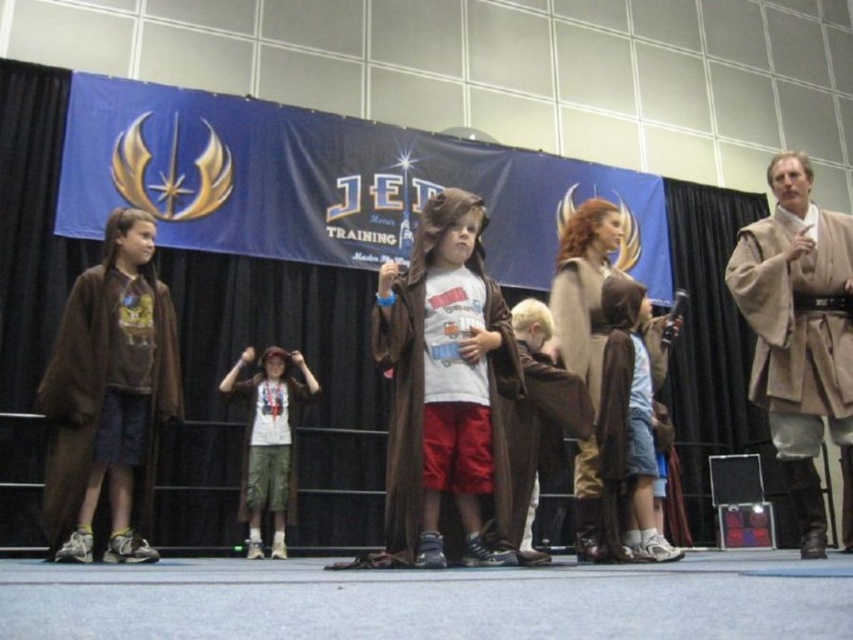
You are a costume designer trying to layer the beige wool robe at center over the white cotton shirt at center for a performance. Based on their thickness, which garment should be placed underneath?

The beige wool robe at center is thinner than the white cotton shirt at center, so the beige wool robe at center should be placed underneath the white cotton shirt at center to ensure proper layering.

You are a photographer at the Jedi Training event. You need to capture a photo that includes both the brown suede robe at left and the brown suede robe at center. Based on their positions, which robe is higher up in the frame?

The brown suede robe at left is located above the brown suede robe at center, so it is higher up in the frame.